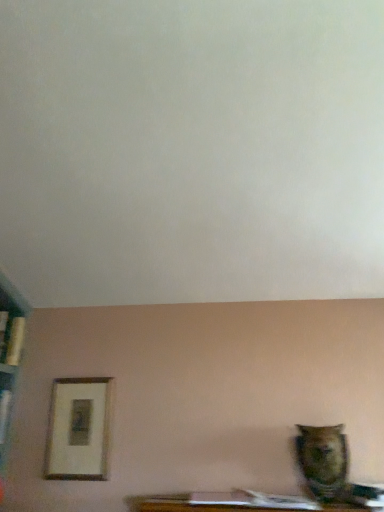
What do you see at coordinates (79, 429) in the screenshot? Image resolution: width=384 pixels, height=512 pixels. I see `wooden framed print at lower left` at bounding box center [79, 429].

Find the location of `wooden framed print at lower left`. wooden framed print at lower left is located at coordinates (79, 429).

You are a GUI agent. You are given a task and a screenshot of the screen. Output one action in this format:
    pyautogui.click(x=<x>, y=<y>)
    Task: Click on the matte brown owl at lower right
    This screenshot has height=512, width=384.
    Given the screenshot: What is the action you would take?
    pyautogui.click(x=323, y=459)

In order to face matte brown owl at lower right, should I rotate leftwards or rightwards?

Turn right by 17.173 degrees to look at matte brown owl at lower right.

Describe the element at coordinates (323, 459) in the screenshot. I see `matte brown owl at lower right` at that location.

This screenshot has width=384, height=512. I want to click on wooden framed print at lower left, so click(x=79, y=429).

Would you say wooden framed print at lower left is to the left or to the right of matte brown owl at lower right in the picture?

In the image, wooden framed print at lower left appears on the left side of matte brown owl at lower right.

Considering their positions, is wooden framed print at lower left located in front of or behind matte brown owl at lower right?

wooden framed print at lower left is positioned farther from the viewer than matte brown owl at lower right.

Is point (58, 378) positioned before point (309, 486)?

No, (58, 378) is further to viewer.

From the image's perspective, which one is positioned lower, wooden framed print at lower left or matte brown owl at lower right?

matte brown owl at lower right appears lower in the image.

From a real-world perspective, is wooden framed print at lower left physically above matte brown owl at lower right?

Indeed, from a real-world perspective, wooden framed print at lower left stands above matte brown owl at lower right.

Considering the sizes of wooden framed print at lower left and matte brown owl at lower right in the image, is wooden framed print at lower left wider or thinner than matte brown owl at lower right?

In the image, wooden framed print at lower left appears to be more narrow than matte brown owl at lower right.

Is wooden framed print at lower left taller or shorter than matte brown owl at lower right?

In the image, wooden framed print at lower left appears to be taller than matte brown owl at lower right.

Based on the photo, is wooden framed print at lower left bigger than matte brown owl at lower right?

No, wooden framed print at lower left is not bigger than matte brown owl at lower right.

Is wooden framed print at lower left surrounding matte brown owl at lower right?

No, matte brown owl at lower right is not surrounded by wooden framed print at lower left.

Would you say wooden framed print at lower left is a long distance from matte brown owl at lower right?

Yes, wooden framed print at lower left and matte brown owl at lower right are located far from each other.

Is matte brown owl at lower right at the back of wooden framed print at lower left?

wooden framed print at lower left does not have its back to matte brown owl at lower right.

What's the angular difference between wooden framed print at lower left and matte brown owl at lower right's facing directions?

There is a 3.48-degree angle between the facing directions of wooden framed print at lower left and matte brown owl at lower right.

How far apart are wooden framed print at lower left and matte brown owl at lower right?

The distance of wooden framed print at lower left from matte brown owl at lower right is 1.04 meters.

You are a GUI agent. You are given a task and a screenshot of the screen. Output one action in this format:
    pyautogui.click(x=<x>, y=<y>)
    Task: Click on the animal in front of the wooden framed print at lower left
    This screenshot has width=384, height=512.
    Given the screenshot: What is the action you would take?
    pyautogui.click(x=323, y=459)

Can you confirm if matte brown owl at lower right is positioned to the left of wooden framed print at lower left?

Incorrect, matte brown owl at lower right is not on the left side of wooden framed print at lower left.

Is the position of matte brown owl at lower right more distant than that of wooden framed print at lower left?

No.

Is point (307, 464) less distant than point (74, 446)?

Yes, point (307, 464) is closer to viewer.

From the image's perspective, is matte brown owl at lower right below wooden framed print at lower left?

Yes, from the image's perspective, matte brown owl at lower right is beneath wooden framed print at lower left.

From a real-world perspective, between matte brown owl at lower right and wooden framed print at lower left, who is vertically higher?

wooden framed print at lower left, from a real-world perspective.

Which of these two, matte brown owl at lower right or wooden framed print at lower left, is wider?

matte brown owl at lower right.

Considering the sizes of matte brown owl at lower right and wooden framed print at lower left in the image, is matte brown owl at lower right taller or shorter than wooden framed print at lower left?

Clearly, matte brown owl at lower right is shorter compared to wooden framed print at lower left.

Between matte brown owl at lower right and wooden framed print at lower left, which one has smaller size?

Smaller between the two is wooden framed print at lower left.

Can wooden framed print at lower left be found inside matte brown owl at lower right?

Actually, wooden framed print at lower left is outside matte brown owl at lower right.

Is matte brown owl at lower right placed right next to wooden framed print at lower left?

No, matte brown owl at lower right is not making contact with wooden framed print at lower left.

Is matte brown owl at lower right looking in the opposite direction of wooden framed print at lower left?

No, matte brown owl at lower right is not facing away from wooden framed print at lower left.

The width and height of the screenshot is (384, 512). Find the location of `picture frame behind the matte brown owl at lower right`. picture frame behind the matte brown owl at lower right is located at coordinates (79, 429).

The image size is (384, 512). I want to click on picture frame behind the matte brown owl at lower right, so click(x=79, y=429).

What are the coordinates of `animal below the wooden framed print at lower left (from the image's perspective)` in the screenshot? It's located at (323, 459).